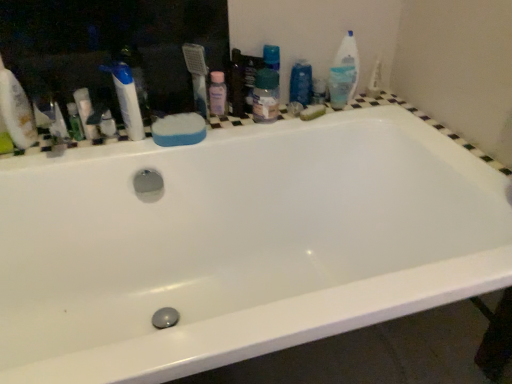
This screenshot has height=384, width=512. What are the coordinates of `green plastic mouthwash at left` in the screenshot? It's located at (75, 122).

Describe the element at coordinates (341, 82) in the screenshot. I see `translucent plastic bottle at upper right, the 1th toiletry viewed from the right` at that location.

The height and width of the screenshot is (384, 512). Describe the element at coordinates (127, 99) in the screenshot. I see `white glossy toothpaste at upper left` at that location.

The height and width of the screenshot is (384, 512). I want to click on white plastic toothbrush at upper left, the fifth toiletry from the right, so click(85, 112).

You are a GUI agent. You are given a task and a screenshot of the screen. Output one action in this format:
    pyautogui.click(x=<x>, y=<y>)
    Task: Click on the green plastic mouthwash at left
    
    Given the screenshot: What is the action you would take?
    point(75,122)

In the scene shown: Does green plastic mouthwash at left lie in front of blue glossy shampoo at upper center, the fourth toiletry when ordered from left to right?

Yes, the depth of green plastic mouthwash at left is less than that of blue glossy shampoo at upper center, the fourth toiletry when ordered from left to right.

Considering the sizes of green plastic mouthwash at left and blue glossy shampoo at upper center, marked as the 2th toiletry in a right-to-left arrangement, in the image, is green plastic mouthwash at left taller or shorter than blue glossy shampoo at upper center, marked as the 2th toiletry in a right-to-left arrangement,?

green plastic mouthwash at left is shorter than blue glossy shampoo at upper center, marked as the 2th toiletry in a right-to-left arrangement.

From the image's perspective, does green plastic mouthwash at left appear lower than blue glossy shampoo at upper center, the fourth toiletry when ordered from left to right?

Yes, from the image's perspective, green plastic mouthwash at left is beneath blue glossy shampoo at upper center, the fourth toiletry when ordered from left to right.

How different are the orientations of green plastic mouthwash at left and blue glossy shampoo at upper center, marked as the 2th toiletry in a right-to-left arrangement, in degrees?

0.00124 degrees.

Based on the photo, visually, is white matte sponge at left, arranged as the first cleaning product when ordered from the bottom, positioned to the left or to the right of white plastic toothbrush at upper left, the first toiletry when ordered from left to right?

white matte sponge at left, arranged as the first cleaning product when ordered from the bottom, is positioned on white plastic toothbrush at upper left, the first toiletry when ordered from left to right,'s left side.

Could you tell me if white matte sponge at left, placed as the first cleaning product when sorted from left to right, is turned towards white plastic toothbrush at upper left, the fifth toiletry from the right?

No.

Which object is wider, white matte sponge at left, placed as the first cleaning product when sorted from left to right, or white plastic toothbrush at upper left, the first toiletry when ordered from left to right?

white plastic toothbrush at upper left, the first toiletry when ordered from left to right.

Is translucent plastic container at upper center, the third toiletry from the left, positioned with its back to white glossy toothpaste at upper left?

translucent plastic container at upper center, the third toiletry from the left, is not turned away from white glossy toothpaste at upper left.

Consider the image. From a real-world perspective, is translucent plastic container at upper center, the third toiletry positioned from the right, on white glossy toothpaste at upper left?

Actually, translucent plastic container at upper center, the third toiletry positioned from the right, is physically below white glossy toothpaste at upper left in the real world.

In the scene shown: From the image's perspective, is translucent plastic container at upper center, the third toiletry from the left, beneath white glossy toothpaste at upper left?

Actually, translucent plastic container at upper center, the third toiletry from the left, appears above white glossy toothpaste at upper left in the image.

Considering the relative sizes of white plastic toothbrush at upper left, the first toiletry when ordered from left to right, and translucent plastic container at upper center, the third toiletry from the left, in the image provided, is white plastic toothbrush at upper left, the first toiletry when ordered from left to right, taller than translucent plastic container at upper center, the third toiletry from the left,?

In fact, white plastic toothbrush at upper left, the first toiletry when ordered from left to right, may be shorter than translucent plastic container at upper center, the third toiletry from the left.

Does white plastic toothbrush at upper left, the first toiletry when ordered from left to right, touch translucent plastic container at upper center, the third toiletry from the left?

white plastic toothbrush at upper left, the first toiletry when ordered from left to right, is not next to translucent plastic container at upper center, the third toiletry from the left, and they're not touching.

Is white plastic toothbrush at upper left, the first toiletry when ordered from left to right, positioned with its back to translucent plastic container at upper center, the third toiletry from the left?

white plastic toothbrush at upper left, the first toiletry when ordered from left to right, is not turned away from translucent plastic container at upper center, the third toiletry from the left.

Which is behind, point (88, 104) or point (272, 107)?

The point (272, 107) is behind.

Would you say white glossy bathtub at upper center is a long distance from white plastic toothbrush at upper left, the first toiletry when ordered from left to right?

They are positioned close to each other.

Considering the relative sizes of white glossy bathtub at upper center and white plastic toothbrush at upper left, the first toiletry when ordered from left to right, in the image provided, is white glossy bathtub at upper center thinner than white plastic toothbrush at upper left, the first toiletry when ordered from left to right,?

Incorrect, the width of white glossy bathtub at upper center is not less than that of white plastic toothbrush at upper left, the first toiletry when ordered from left to right.

Is point (480, 167) closer or farther from the camera than point (84, 105)?

Point (480, 167).

From a real-world perspective, is white glossy bathtub at upper center located higher than white plastic toothbrush at upper left, the fifth toiletry from the right?

No, from a real-world perspective, white glossy bathtub at upper center is not on top of white plastic toothbrush at upper left, the fifth toiletry from the right.

Is the position of white matte sponge at left, placed as the first cleaning product when sorted from left to right, more distant than that of green sponge at upper right, the 2th soap positioned from the front?

No, the depth of white matte sponge at left, placed as the first cleaning product when sorted from left to right, is less than that of green sponge at upper right, the 2th soap positioned from the front.

Starting from the green sponge at upper right, which appears as the first soap when viewed from the back, which cleaning product is the 2nd one in front? Please provide its 2D coordinates.

[(16, 110)]

Can you confirm if white matte sponge at left, which is the 2th cleaning product from top to bottom, is shorter than green sponge at upper right, which appears as the first soap when viewed from the back?

Incorrect, the height of white matte sponge at left, which is the 2th cleaning product from top to bottom, does not fall short of that of green sponge at upper right, which appears as the first soap when viewed from the back.

Is green sponge at upper right, which appears as the first soap when viewed from the back, inside white matte sponge at left, positioned as the second cleaning product in right-to-left order?

No, green sponge at upper right, which appears as the first soap when viewed from the back, is located outside of white matte sponge at left, positioned as the second cleaning product in right-to-left order.

From the image's perspective, is blue sponge at upper left, arranged as the second soap when viewed from the back, on top of blue glossy shampoo at upper center, marked as the 2th toiletry in a right-to-left arrangement?

No, from the image's perspective, blue sponge at upper left, arranged as the second soap when viewed from the back, is not above blue glossy shampoo at upper center, marked as the 2th toiletry in a right-to-left arrangement.

Is blue sponge at upper left, arranged as the second soap when viewed from the back, at the left side of blue glossy shampoo at upper center, marked as the 2th toiletry in a right-to-left arrangement?

Yes, blue sponge at upper left, arranged as the second soap when viewed from the back, is to the left of blue glossy shampoo at upper center, marked as the 2th toiletry in a right-to-left arrangement.

Considering the sizes of blue sponge at upper left, arranged as the second soap when viewed from the back, and blue glossy shampoo at upper center, the fourth toiletry when ordered from left to right, in the image, is blue sponge at upper left, arranged as the second soap when viewed from the back, bigger or smaller than blue glossy shampoo at upper center, the fourth toiletry when ordered from left to right,?

Clearly, blue sponge at upper left, arranged as the second soap when viewed from the back, is larger in size than blue glossy shampoo at upper center, the fourth toiletry when ordered from left to right.

Measure the distance from blue sponge at upper left, the first soap positioned from the front, to blue glossy shampoo at upper center, marked as the 2th toiletry in a right-to-left arrangement.

They are 15.30 inches apart.

Locate an element on the screen. This screenshot has width=512, height=384. mouthwash located in front of the blue glossy shampoo at upper center, the fourth toiletry when ordered from left to right is located at coordinates (75, 122).

From a real-world perspective, which toiletry is the 4th one underneath the white matte sponge at left, placed as the first cleaning product when sorted from left to right? Please provide its 2D coordinates.

[(85, 112)]

When comparing their distances from white plastic toothbrush at upper left, the fifth toiletry from the right, does white matte sponge at left, which is the 2th cleaning product from top to bottom, or white glossy toothpaste at upper left seem further?

Among the two, white matte sponge at left, which is the 2th cleaning product from top to bottom, is located further to white plastic toothbrush at upper left, the fifth toiletry from the right.

Considering their positions, is translucent plastic bottle at upper right, which is counted as the 2th cleaning product, starting from the left, positioned closer to blue sponge at upper left, the first soap positioned from the front, than white glossy bathtub at upper center?

Among the two, white glossy bathtub at upper center is located nearer to blue sponge at upper left, the first soap positioned from the front.

Which object lies nearer to the anchor point blue sponge at upper left, the first soap positioned from the front, white matte sponge at left, which is the 2th cleaning product from top to bottom, or translucent plastic container at upper center, the third toiletry from the left?

translucent plastic container at upper center, the third toiletry from the left.

Estimate the real-world distances between objects in this image. Which object is closer to translucent plastic container at upper center, the third toiletry positioned from the right, white plastic toothbrush at upper left, the fifth toiletry from the right, or green plastic mouthwash at left?

Based on the image, white plastic toothbrush at upper left, the fifth toiletry from the right, appears to be nearer to translucent plastic container at upper center, the third toiletry positioned from the right.

From the image, which object appears to be nearer to green sponge at upper right, the 2th soap positioned from the front, white matte sponge at left, arranged as the first cleaning product when ordered from the bottom, or translucent plastic bottle at upper right, the fifth toiletry when ordered from left to right?

Among the two, translucent plastic bottle at upper right, the fifth toiletry when ordered from left to right, is located nearer to green sponge at upper right, the 2th soap positioned from the front.

Looking at the image, which one is located further to white glossy toothpaste at upper left, white plastic toothbrush at upper left, the first toiletry when ordered from left to right, or blue glossy shampoo at upper center, marked as the 2th toiletry in a right-to-left arrangement?

Among the two, blue glossy shampoo at upper center, marked as the 2th toiletry in a right-to-left arrangement, is located further to white glossy toothpaste at upper left.

When comparing their distances from green sponge at upper right, which appears as the first soap when viewed from the right, does white plastic toothbrush at upper left, the first toiletry when ordered from left to right, or translucent plastic container at upper center, the third toiletry positioned from the right, seem further?

A: white plastic toothbrush at upper left, the first toiletry when ordered from left to right, lies further to green sponge at upper right, which appears as the first soap when viewed from the right, than the other object.

From the image, which object appears to be nearer to pink plastic bottle at upper center, placed as the fourth toiletry when sorted from right to left, blue sponge at upper left, arranged as the second soap when viewed from the back, or white plastic medicine cabinet at upper left?

blue sponge at upper left, arranged as the second soap when viewed from the back, lies closer to pink plastic bottle at upper center, placed as the fourth toiletry when sorted from right to left, than the other object.

Identify the location of soap located between white plastic toothbrush at upper left, the first toiletry when ordered from left to right, and blue glossy shampoo at upper center, marked as the 2th toiletry in a right-to-left arrangement, in the left-right direction. The height and width of the screenshot is (384, 512). (179, 130).

This screenshot has height=384, width=512. In order to click on toothpaste between green plastic mouthwash at left and blue sponge at upper left, which is counted as the 1th soap, starting from the left, in the horizontal direction in this screenshot , I will do `click(127, 99)`.

Find the location of a particular element. Image resolution: width=512 pixels, height=384 pixels. mouthwash located between white matte sponge at left, arranged as the 1th cleaning product when viewed from the front, and white plastic toothbrush at upper left, the first toiletry when ordered from left to right, in the left-right direction is located at coordinates (75, 122).

The height and width of the screenshot is (384, 512). Identify the location of soap between white glossy bathtub at upper center and green plastic mouthwash at left along the z-axis. (179, 130).